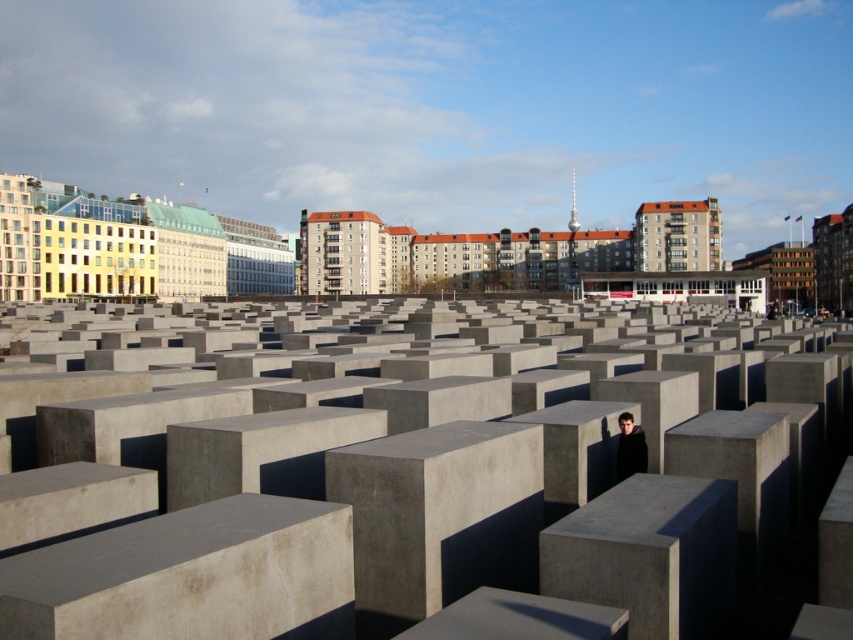
You are a photographer trying to capture the black matte jacket at center and the smooth gray concrete blocks at center in the same frame. Based on their sizes, which object would appear larger in your photo?

The smooth gray concrete blocks at center would appear larger in the photo since they are bigger than the black matte jacket at center.

You are standing at the entrance of the maze formed by the smooth gray concrete blocks at center and the black matte jacket at center. Which object is closer to you?

The smooth gray concrete blocks at center are closer to you since they are in front of the black matte jacket at center.

You are a photographer standing at the edge of the concrete block field. You notice both the smooth gray concrete blocks at center and the black matte jacket at center. Which object is positioned higher in the scene?

The smooth gray concrete blocks at center is located above the black matte jacket at center, so it is positioned higher in the scene.